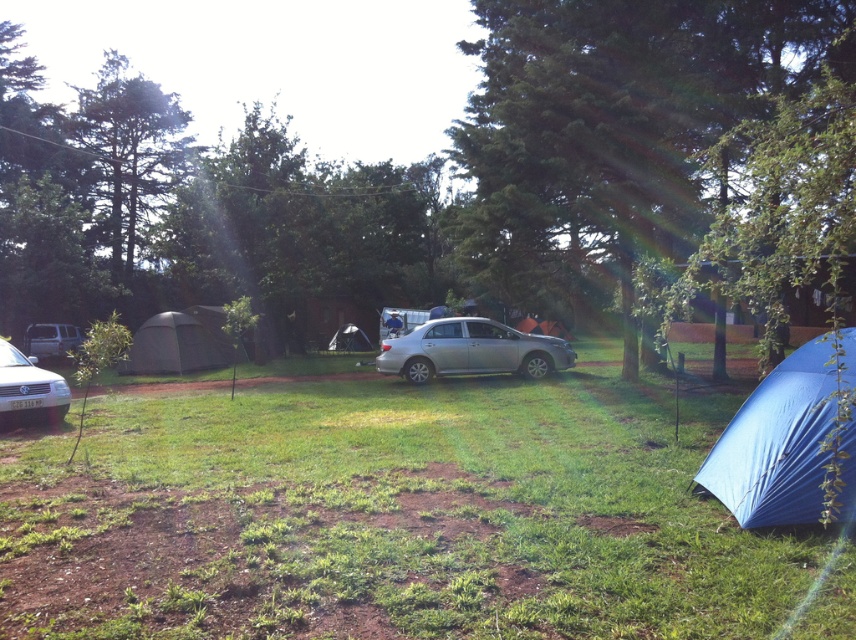
Measure the distance between silver metallic car at center and metallic silver van at left.

The distance of silver metallic car at center from metallic silver van at left is 20.56 meters.

Can you confirm if silver metallic car at center is taller than metallic silver van at left?

Yes, silver metallic car at center is taller than metallic silver van at left.

Locate an element on the screen. Image resolution: width=856 pixels, height=640 pixels. silver metallic car at center is located at coordinates (471, 349).

Which is in front, point (795, 465) or point (16, 349)?

Point (795, 465) is in front.

Does blue tarpaulin tent at lower right appear on the right side of silver metallic car at lower left?

Indeed, blue tarpaulin tent at lower right is positioned on the right side of silver metallic car at lower left.

Which is behind, point (771, 509) or point (64, 413)?

Positioned behind is point (64, 413).

Where is `blue tarpaulin tent at lower right`? This screenshot has height=640, width=856. blue tarpaulin tent at lower right is located at coordinates (776, 444).

Between point (428, 588) and point (210, 323), which one is positioned behind?

The point (210, 323) is behind.

Does green grass at center have a lesser height compared to dark green fabric tent at lower left?

A: Correct, green grass at center is not as tall as dark green fabric tent at lower left.

Is point (468, 378) positioned in front of point (162, 360)?

Yes.

The width and height of the screenshot is (856, 640). Identify the location of green grass at center. (389, 516).